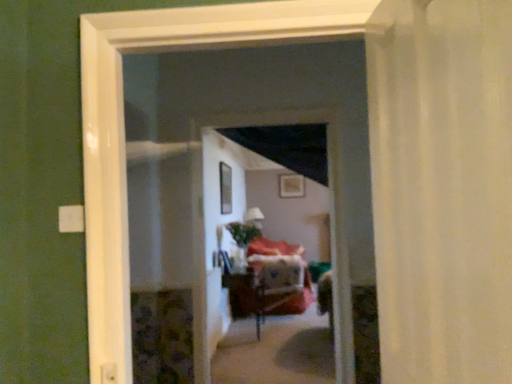
Question: Does point (228, 195) appear closer or farther from the camera than point (287, 180)?

Choices:
 (A) farther
 (B) closer

Answer: (B)

Question: In terms of width, does transparent glass window at center look wider or thinner when compared to wooden picture frame at upper center?

Choices:
 (A) thin
 (B) wide

Answer: (B)

Question: Which of these objects is positioned closest to the transparent glass window at center?

Choices:
 (A) green matte plant at center
 (B) white sheer curtain at right
 (C) wooden picture frame at upper center
 (D) wooden table at center
 (E) wooden screen door at center

Answer: (A)

Question: Which of these objects is positioned closest to the white sheer curtain at right?

Choices:
 (A) wooden screen door at center
 (B) wooden picture frame at upper center
 (C) transparent glass window at center
 (D) wooden table at center
 (E) green matte plant at center

Answer: (A)